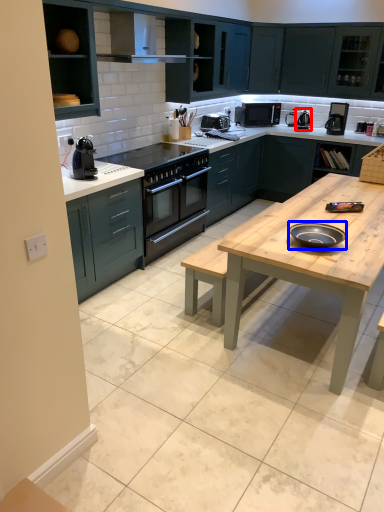
Question: Which object appears farthest to the camera in this image, appliance (highlighted by a red box) or pizza pan (highlighted by a blue box)?

Choices:
 (A) appliance
 (B) pizza pan

Answer: (A)